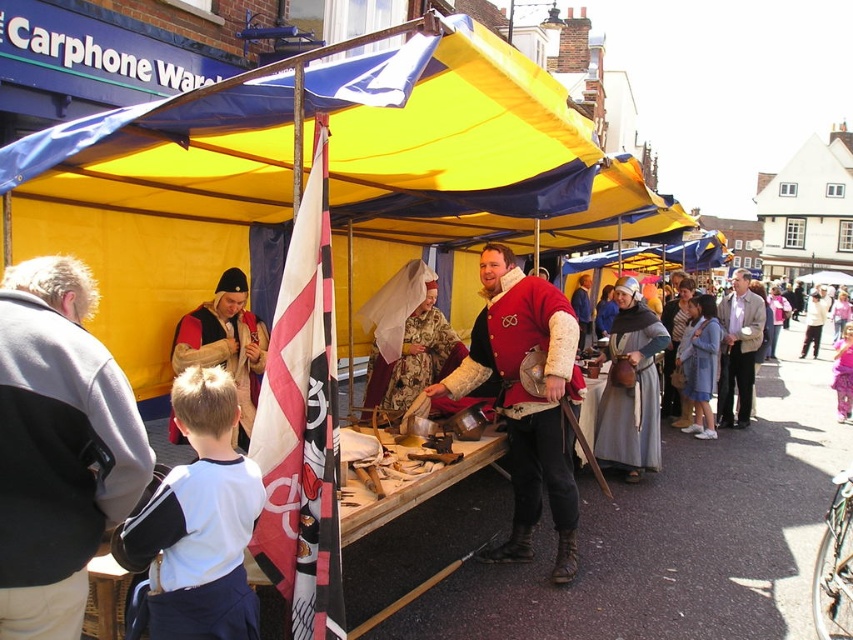
Which is below, matte red leather jacket at center or white cotton shirt at center?

Positioned lower is matte red leather jacket at center.

Between point (514, 545) and point (815, 321), which one is positioned in front?

Positioned in front is point (514, 545).

Is point (540, 401) positioned behind point (811, 310)?

No, (540, 401) is in front of (811, 310).

At what (x,y) coordinates should I click in order to perform the action: click on matte red leather jacket at center. Please return your answer as a coordinate pair (x, y). The width and height of the screenshot is (853, 640). Looking at the image, I should click on (526, 400).

Does gray fleece jacket at left have a greater width compared to silk blue gown at center?

→ No, gray fleece jacket at left is not wider than silk blue gown at center.

Who is taller, gray fleece jacket at left or silk blue gown at center?

With more height is silk blue gown at center.

Is point (126, 448) positioned in front of point (631, 376)?

Yes, point (126, 448) is closer to viewer.

You are a GUI agent. You are given a task and a screenshot of the screen. Output one action in this format:
    pyautogui.click(x=<x>, y=<y>)
    Task: Click on the gray fleece jacket at left
    The height and width of the screenshot is (640, 853).
    Given the screenshot: What is the action you would take?
    pyautogui.click(x=57, y=445)

Does gray fleece jacket at left appear on the right side of light blue denim dress at lower right?

Incorrect, gray fleece jacket at left is not on the right side of light blue denim dress at lower right.

Is point (22, 406) farther from viewer compared to point (689, 365)?

No, (22, 406) is in front of (689, 365).

Does point (102, 364) lie behind point (703, 381)?

No, (102, 364) is in front of (703, 381).

Locate an element on the screen. Image resolution: width=853 pixels, height=640 pixels. gray fleece jacket at left is located at coordinates (57, 445).